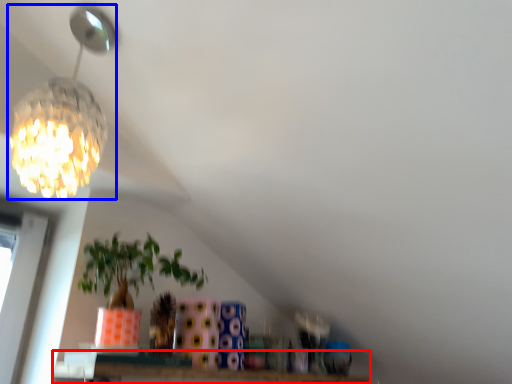
Question: Which of the following is the farthest to the observer, window (highlighted by a red box) or lamp (highlighted by a blue box)?

Choices:
 (A) window
 (B) lamp

Answer: (A)